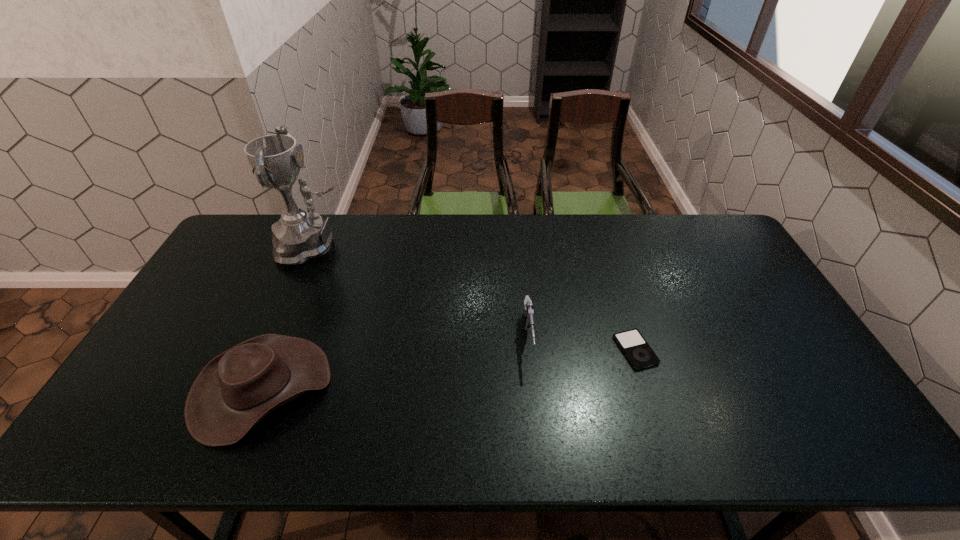
Image resolution: width=960 pixels, height=540 pixels. Identify the location of object situated at the far edge. (300, 235).

I want to click on object that is positioned at the near edge, so click(237, 389).

The width and height of the screenshot is (960, 540). I want to click on blank space at the far edge, so click(x=441, y=220).

The height and width of the screenshot is (540, 960). In order to click on free location at the near edge of the desktop in this screenshot , I will do `click(759, 422)`.

Image resolution: width=960 pixels, height=540 pixels. I want to click on vacant space at the left edge of the desktop, so click(x=186, y=321).

In the image, there is a desktop. Where is `vacant space at the right edge`? The image size is (960, 540). vacant space at the right edge is located at coordinates (736, 275).

At what (x,y) coordinates should I click in order to perform the action: click on free space at the far left corner of the desktop. Please return your answer as a coordinate pair (x, y). This screenshot has height=540, width=960. Looking at the image, I should click on (228, 247).

You are a GUI agent. You are given a task and a screenshot of the screen. Output one action in this format:
    pyautogui.click(x=<x>, y=<y>)
    Task: Click on the free spot at the far right corner of the desktop
    
    Given the screenshot: What is the action you would take?
    pyautogui.click(x=682, y=223)

At what (x,y) coordinates should I click in order to perform the action: click on blank region between the tallest object and the cowboy hat. Please return your answer as a coordinate pair (x, y). This screenshot has height=540, width=960. Looking at the image, I should click on (289, 317).

Locate an element on the screen. The width and height of the screenshot is (960, 540). unoccupied area between the award and the cowboy hat is located at coordinates point(289,317).